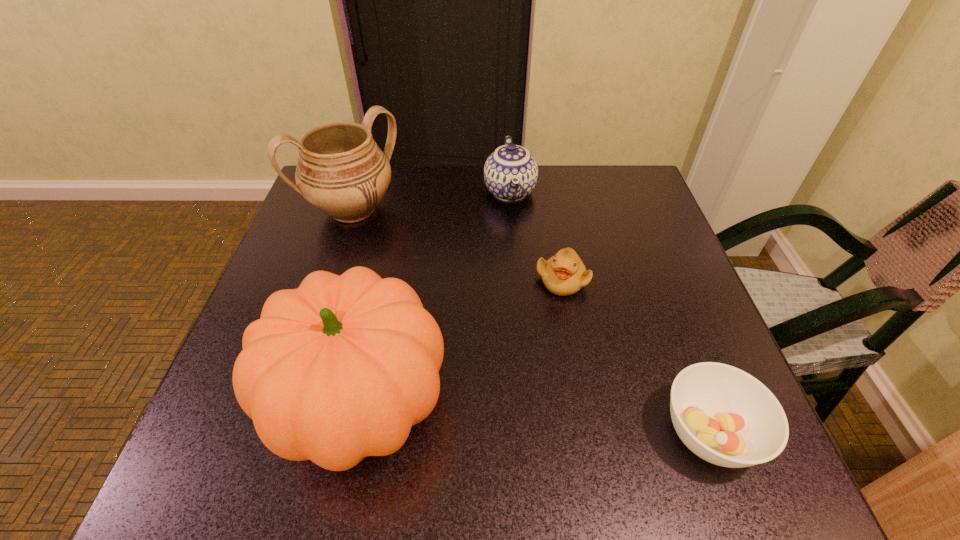
The width and height of the screenshot is (960, 540). Identify the location of object that ranks as the second closest to the duckling. (341, 368).

Locate an element on the screen. This screenshot has height=540, width=960. vacant region that satisfies the following two spatial constraints: 1. on the front side of the third shortest object; 2. on the left side of the third nearest object is located at coordinates (516, 280).

This screenshot has width=960, height=540. What are the coordinates of `free spot that satisfies the following two spatial constraints: 1. on the front side of the urn; 2. on the right side of the pumpkin` in the screenshot? It's located at (289, 404).

Locate an element on the screen. vacant space that satisfies the following two spatial constraints: 1. on the front side of the third shortest object; 2. on the right side of the duckling is located at coordinates (516, 280).

Where is `free space that satisfies the following two spatial constraints: 1. on the front side of the rightmost object; 2. on the right side of the urn`? The width and height of the screenshot is (960, 540). free space that satisfies the following two spatial constraints: 1. on the front side of the rightmost object; 2. on the right side of the urn is located at coordinates (280, 433).